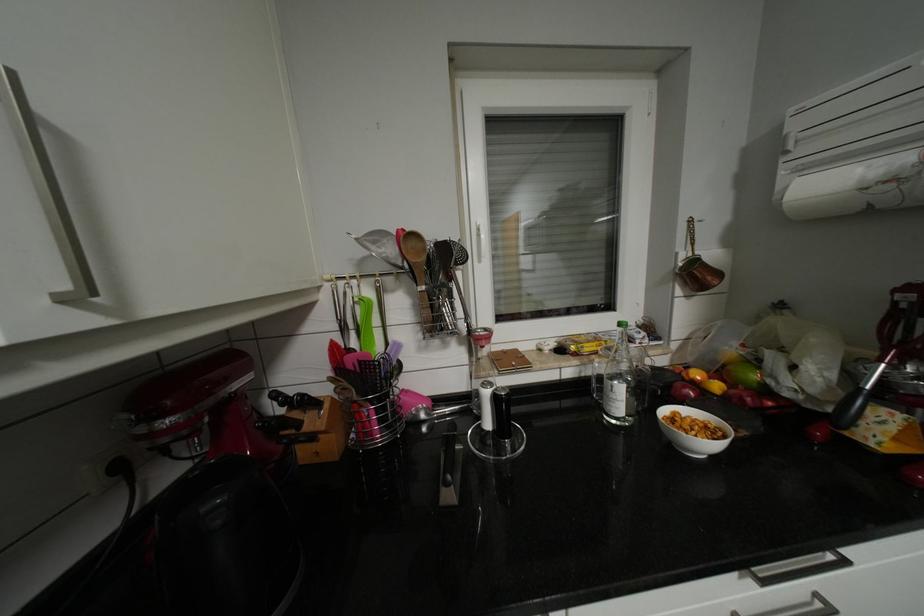
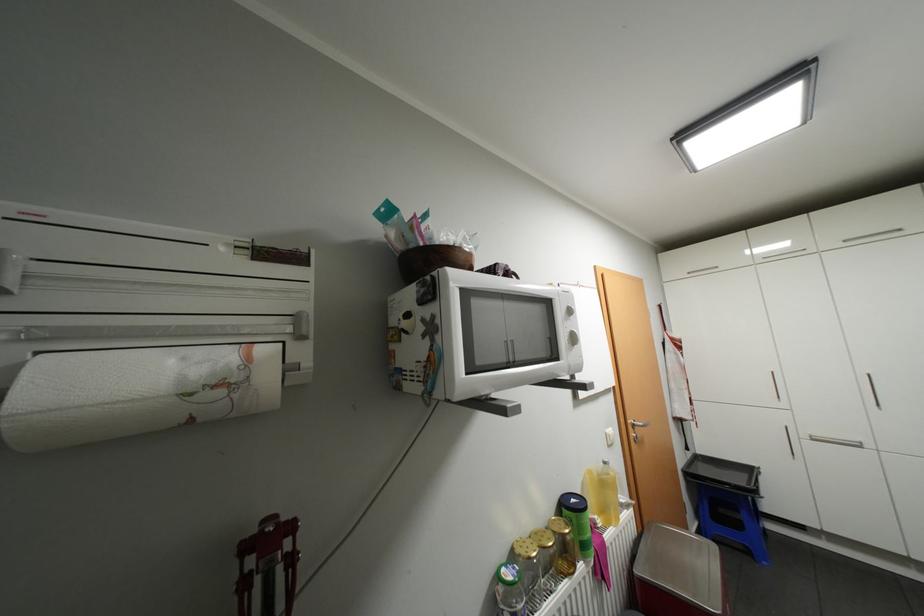
In the second image, find the point that corresponds to (794,152) in the first image.

(6, 291)